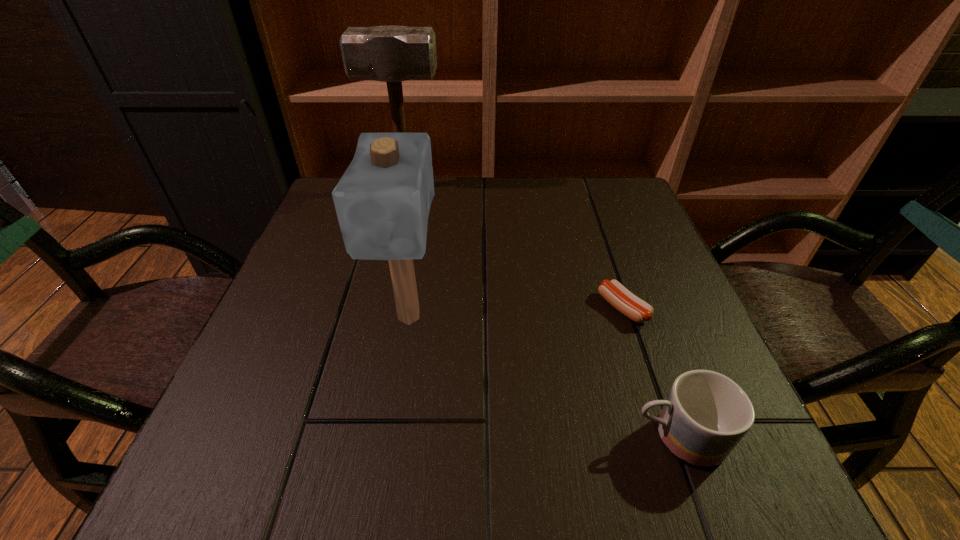
Locate an element on the screen. The width and height of the screenshot is (960, 540). vacant area that lies between the nearest object and the nearer mallet is located at coordinates (543, 377).

Where is `the second closest object relative to the nearer mallet`? The image size is (960, 540). the second closest object relative to the nearer mallet is located at coordinates (706, 414).

Point out which object is positioned as the third nearest to the farthest object. Please provide its 2D coordinates. Your answer should be formatted as a tuple, i.e. [(x, y)], where the tuple contains the x and y coordinates of a point satisfying the conditions above.

[(706, 414)]

At what (x,y) coordinates should I click in order to perform the action: click on vacant space that satisfies the following two spatial constraints: 1. on the striking face of the farther mallet; 2. on the left side of the nearer mallet. Please return your answer as a coordinate pair (x, y). The height and width of the screenshot is (540, 960). Looking at the image, I should click on (376, 318).

This screenshot has width=960, height=540. Find the location of `free point that satisfies the following two spatial constraints: 1. on the striking face of the farther mallet; 2. on the back side of the sausage`. free point that satisfies the following two spatial constraints: 1. on the striking face of the farther mallet; 2. on the back side of the sausage is located at coordinates click(x=378, y=308).

At what (x,y) coordinates should I click in order to perform the action: click on vacant space that satisfies the following two spatial constraints: 1. on the striking face of the farther mallet; 2. on the right side of the nearer mallet. Please return your answer as a coordinate pair (x, y). This screenshot has width=960, height=540. Looking at the image, I should click on (376, 318).

Locate an element on the screen. blank space that satisfies the following two spatial constraints: 1. on the back side of the nearer mallet; 2. on the right side of the sausage is located at coordinates (411, 308).

This screenshot has height=540, width=960. Identify the location of free spot that satisfies the following two spatial constraints: 1. on the striking face of the farthest object; 2. on the left side of the nearer mallet. (376, 318).

Locate an element on the screen. vacant region that satisfies the following two spatial constraints: 1. on the back side of the nearer mallet; 2. on the striking face of the farther mallet is located at coordinates (430, 187).